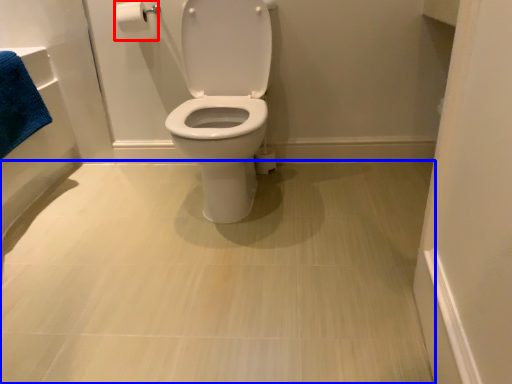
Question: Which of the following is the farthest to the observer, toilet paper (highlighted by a red box) or plain (highlighted by a blue box)?

Choices:
 (A) toilet paper
 (B) plain

Answer: (A)